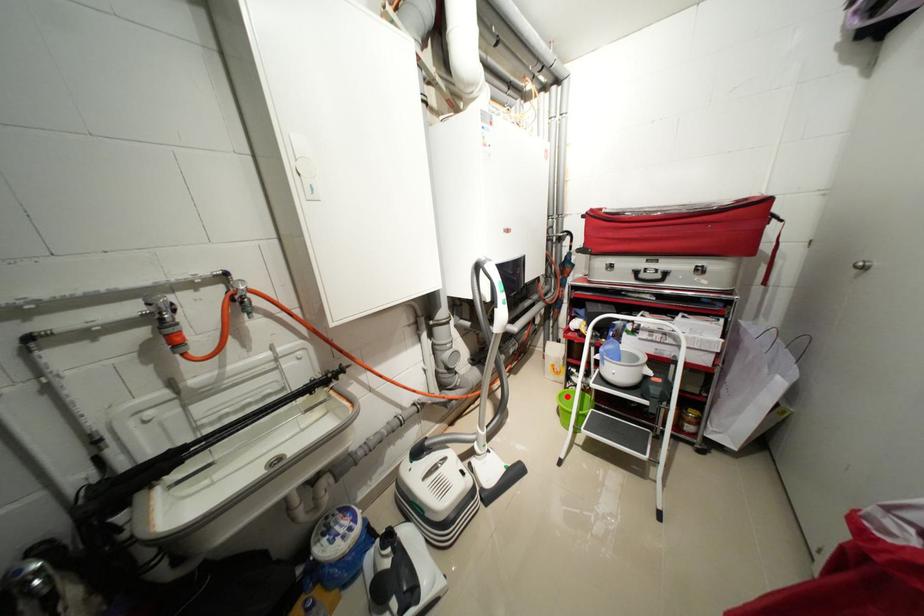
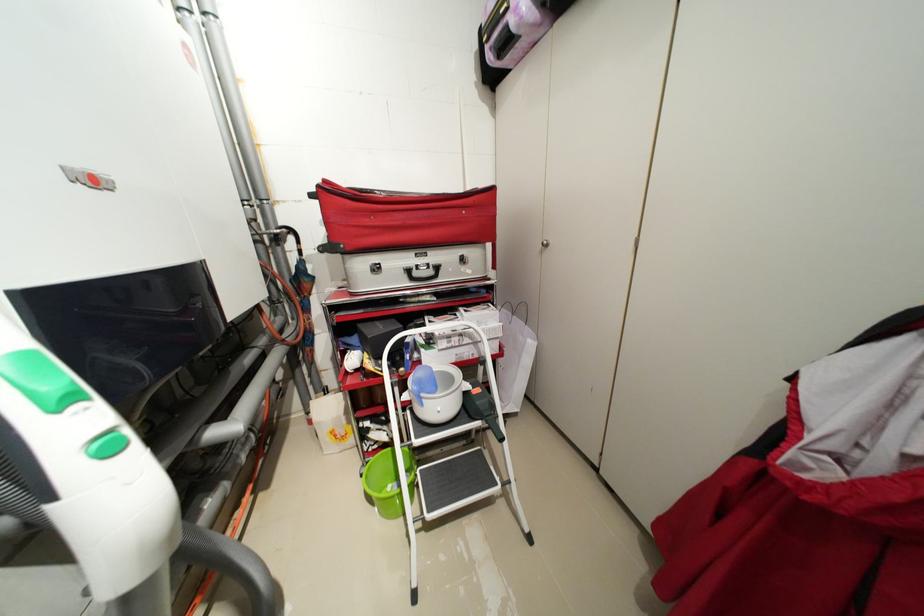
Where in the second image is the point corresponding to the highlighted location from the first image?

(373, 479)